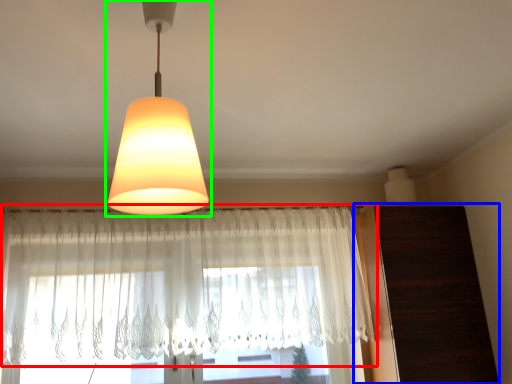
Question: Which object is the closest to the curtain (highlighted by a red box)? Choose among these: dresser (highlighted by a blue box) or lamp (highlighted by a green box).

Choices:
 (A) dresser
 (B) lamp

Answer: (A)